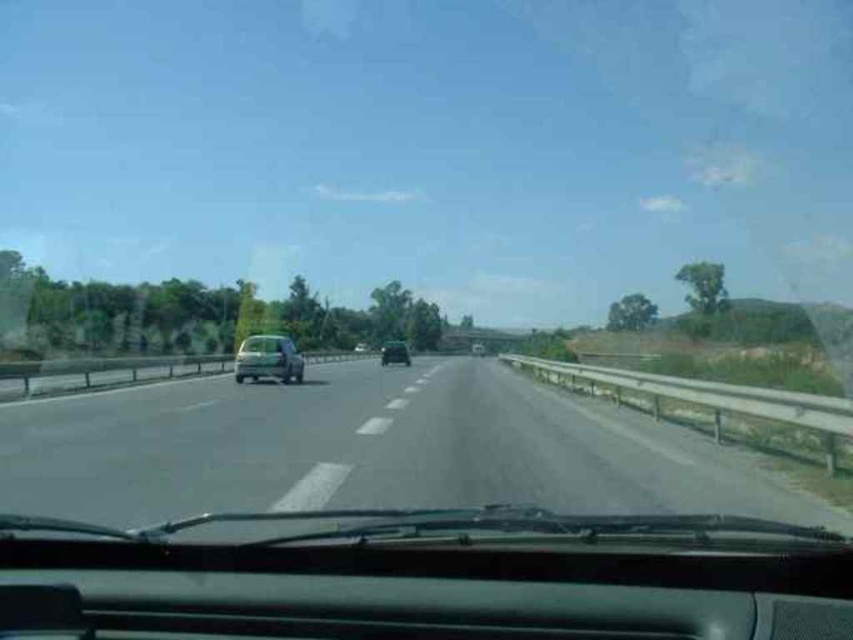
You are driving a car and need to determine the distance between two points on the road ahead. Using the coordinates provided, can you tell if the point at (250, 378) is closer to you than the point at (469, 352)?

Yes, the point at (250, 378) is closer to the viewer than the point at (469, 352) according to the description.

You are driving a car and see the green matte car at center and the metallic silver sedan at center ahead on the highway. Which one is closer to you?

The green matte car at center is closer to you because it is in front of the metallic silver sedan at center.

You are driving a car and see the metallic silver car at left and the metallic silver sedan at center ahead on the highway. Which vehicle is closer to you based on their positions?

The metallic silver car at left is closer to you because it is positioned in front of the metallic silver sedan at center.